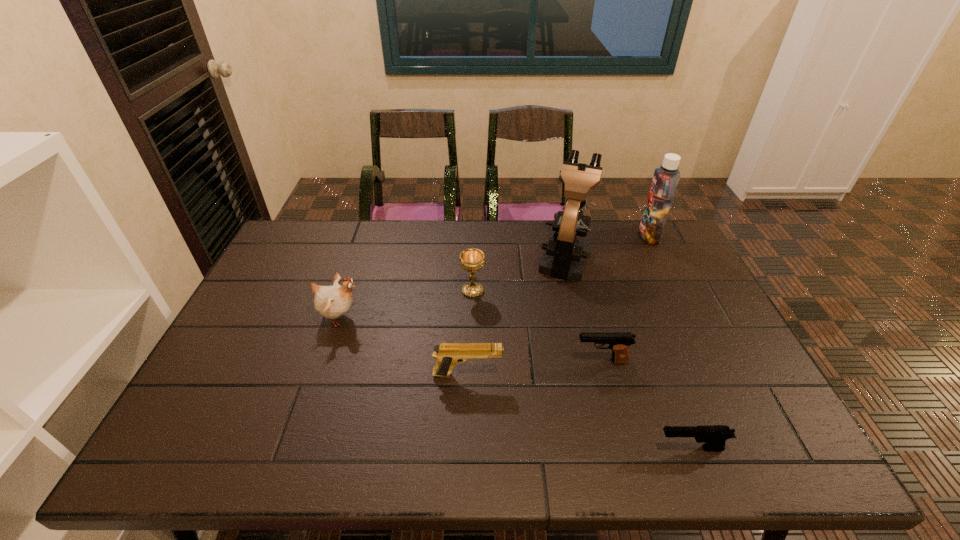
Image resolution: width=960 pixels, height=540 pixels. I want to click on vacant region at the far edge of the desktop, so click(547, 225).

In the image, there is a desktop. What are the coordinates of `vacant area at the near edge` in the screenshot? It's located at (301, 444).

In the image, there is a desktop. Where is `vacant space at the left edge`? vacant space at the left edge is located at coordinates (257, 285).

This screenshot has height=540, width=960. What are the coordinates of `free point at the right edge` in the screenshot? It's located at (718, 373).

I want to click on vacant space at the far left corner of the desktop, so click(324, 224).

I want to click on free region at the near left corner of the desktop, so click(239, 435).

Find the location of a particular element. This screenshot has height=540, width=960. vacant region at the near right corner of the desktop is located at coordinates (753, 460).

Locate an element on the screen. empty space that is in between the bird and the chalice is located at coordinates (406, 304).

Image resolution: width=960 pixels, height=540 pixels. What are the coordinates of `vacant area that lies between the microscope and the bird` in the screenshot? It's located at (452, 287).

Where is `free space between the third nearest object and the leftmost object`? The width and height of the screenshot is (960, 540). free space between the third nearest object and the leftmost object is located at coordinates (470, 339).